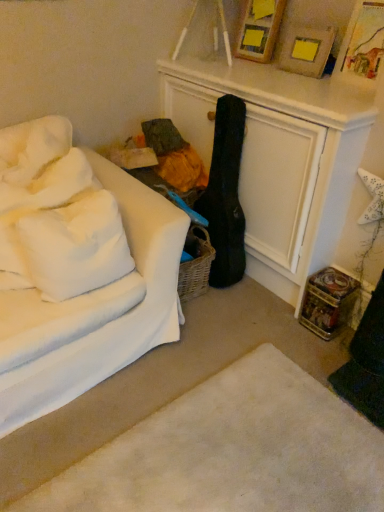
Question: Can you confirm if wooden picture frame at upper center, the first picture frame in the back-to-front sequence, is thinner than white fabric couch at left?

Choices:
 (A) no
 (B) yes

Answer: (B)

Question: Is wooden picture frame at upper center, the first picture frame in the back-to-front sequence, aimed at white fabric couch at left?

Choices:
 (A) yes
 (B) no

Answer: (A)

Question: Is wooden picture frame at upper center, the first picture frame in the back-to-front sequence, closer to the viewer compared to white fabric couch at left?

Choices:
 (A) yes
 (B) no

Answer: (B)

Question: From the image's perspective, is wooden picture frame at upper center, which ranks as the second picture frame in front-to-back order, on top of white fabric couch at left?

Choices:
 (A) yes
 (B) no

Answer: (A)

Question: Considering the relative positions of wooden picture frame at upper center, the first picture frame in the back-to-front sequence, and white fabric couch at left in the image provided, is wooden picture frame at upper center, the first picture frame in the back-to-front sequence, behind white fabric couch at left?

Choices:
 (A) yes
 (B) no

Answer: (A)

Question: Relative to wooden picture frame at upper center, the first picture frame in the back-to-front sequence, is white soft rug at lower center in front or behind?

Choices:
 (A) front
 (B) behind

Answer: (A)

Question: Is white soft rug at lower center taller or shorter than wooden picture frame at upper center, the first picture frame in the back-to-front sequence?

Choices:
 (A) short
 (B) tall

Answer: (A)

Question: Considering the positions of white soft rug at lower center and wooden picture frame at upper center, which ranks as the second picture frame in front-to-back order, in the image, is white soft rug at lower center wider or thinner than wooden picture frame at upper center, which ranks as the second picture frame in front-to-back order,?

Choices:
 (A) wide
 (B) thin

Answer: (A)

Question: From a real-world perspective, relative to wooden picture frame at upper center, which ranks as the second picture frame in front-to-back order, is white soft rug at lower center vertically above or below?

Choices:
 (A) above
 (B) below

Answer: (B)

Question: From a real-world perspective, is white soft pillow at upper left, which is the second pillow from bottom to top, physically located above or below white soft pillow at left, which is the second pillow from top to bottom?

Choices:
 (A) below
 (B) above

Answer: (B)

Question: Considering the positions of white soft pillow at upper left, which is the second pillow from bottom to top, and white soft pillow at left, which is the second pillow from top to bottom, in the image, is white soft pillow at upper left, which is the second pillow from bottom to top, taller or shorter than white soft pillow at left, which is the second pillow from top to bottom,?

Choices:
 (A) tall
 (B) short

Answer: (B)

Question: Based on their sizes in the image, would you say white soft pillow at upper left, which is the second pillow from bottom to top, is bigger or smaller than white soft pillow at left, which is the second pillow from top to bottom?

Choices:
 (A) small
 (B) big

Answer: (A)

Question: Is white soft pillow at upper left, which is the second pillow from bottom to top, in front of or behind white soft pillow at left, the 1th pillow positioned from the bottom, in the image?

Choices:
 (A) front
 (B) behind

Answer: (B)

Question: Is wooden picture frame at upper right, the 1th picture frame viewed from the front, inside the boundaries of white soft pillow at left, which is the second pillow from top to bottom, or outside?

Choices:
 (A) outside
 (B) inside

Answer: (A)

Question: Based on their sizes in the image, would you say wooden picture frame at upper right, the 1th picture frame viewed from the front, is bigger or smaller than white soft pillow at left, which is the second pillow from top to bottom?

Choices:
 (A) small
 (B) big

Answer: (A)